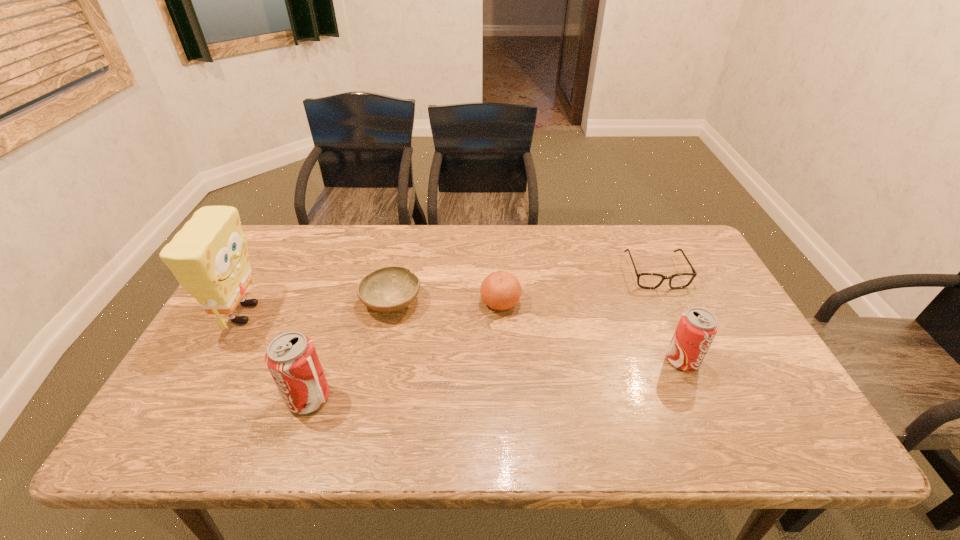
Where is `object present at the far right corner`? The width and height of the screenshot is (960, 540). object present at the far right corner is located at coordinates (644, 280).

This screenshot has width=960, height=540. I want to click on free location at the far edge, so click(x=535, y=252).

Where is `free space at the left edge of the desktop`? The image size is (960, 540). free space at the left edge of the desktop is located at coordinates (258, 318).

Identify the location of free space at the far left corner. The image size is (960, 540). (289, 245).

In the image, there is a desktop. Where is `vacant area at the near left corner`? Image resolution: width=960 pixels, height=540 pixels. vacant area at the near left corner is located at coordinates (223, 382).

The image size is (960, 540). In the image, there is a desktop. Find the location of `vacant area at the far right corner`. vacant area at the far right corner is located at coordinates (674, 237).

This screenshot has width=960, height=540. I want to click on unoccupied position between the tallest object and the spectacles, so (x=450, y=293).

Where is `vacant area that lies between the spectacles and the fifth shortest object`? vacant area that lies between the spectacles and the fifth shortest object is located at coordinates (482, 335).

In order to click on vacant area between the clementine and the spectacles in this screenshot , I will do click(x=578, y=288).

Locate an element on the screen. The height and width of the screenshot is (540, 960). free space that is in between the shorter soda can and the second tallest object is located at coordinates (495, 379).